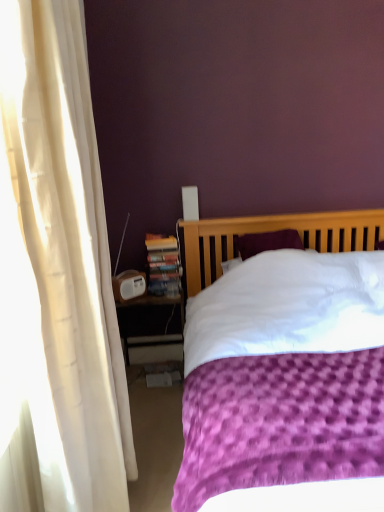
The image size is (384, 512). What do you see at coordinates (272, 231) in the screenshot?
I see `purple textured bed at center` at bounding box center [272, 231].

Based on the photo, what is the approximate height of hardcover book at left?

hardcover book at left is 15.03 inches tall.

Find the location of `purple textured bed at center`. purple textured bed at center is located at coordinates (272, 231).

Based on the photo, are white plastic nightstand at lower left and hardcover book at left far apart?

Actually, white plastic nightstand at lower left and hardcover book at left are a little close together.

From a real-world perspective, between white plastic nightstand at lower left and hardcover book at left, who is vertically higher?

From a 3D spatial view, hardcover book at left is above.

Relative to hardcover book at left, is white plastic nightstand at lower left in front or behind?

Clearly, white plastic nightstand at lower left is in front of hardcover book at left.

From the image's perspective, would you say white plastic nightstand at lower left is positioned over hardcover book at left?

Actually, white plastic nightstand at lower left appears below hardcover book at left in the image.

In the scene shown: Who is bigger, purple textured bed at center or hardcover book at left?

Bigger between the two is purple textured bed at center.

Is purple textured bed at center placed right next to hardcover book at left?

No, purple textured bed at center is not next to hardcover book at left.

Consider the image. Which object is positioned more to the right, purple textured bed at center or hardcover book at left?

purple textured bed at center is more to the right.

What's the angular difference between purple textured bed at center and hardcover book at left's facing directions?

They differ by 0.354 degrees in their facing directions.

Does hardcover book at left appear on the left side of purple textured bed at center?

Correct, you'll find hardcover book at left to the left of purple textured bed at center.

From the picture: From a real-world perspective, is hardcover book at left located beneath purple textured bed at center?

Incorrect, from a real-world perspective, hardcover book at left is higher than purple textured bed at center.

Does point (179, 271) appear closer or farther from the camera than point (275, 222)?

Point (179, 271) is positioned closer to the camera compared to point (275, 222).

Locate an element on the screen. paperback book behind the purple textured bed at center is located at coordinates (163, 266).

Could you tell me if purple textured bed at center is facing white plastic nightstand at lower left?

No, purple textured bed at center is not aimed at white plastic nightstand at lower left.

From the image's perspective, does purple textured bed at center appear lower than white plastic nightstand at lower left?

No.

Considering the sizes of objects purple textured bed at center and white plastic nightstand at lower left in the image provided, who is wider, purple textured bed at center or white plastic nightstand at lower left?

Wider between the two is purple textured bed at center.

Does point (177, 302) lie in front of point (346, 482)?

No.

Is white plastic nightstand at lower left spatially inside purple textured bed at center, or outside of it?

white plastic nightstand at lower left is spatially situated outside purple textured bed at center.

Where is `nightstand that appears below the purple textured bed at center (from the image's perspective)`? nightstand that appears below the purple textured bed at center (from the image's perspective) is located at coordinates (151, 329).

From the picture: Is white plastic nightstand at lower left placed right next to purple textured bed at center?

There is a gap between white plastic nightstand at lower left and purple textured bed at center.

From the picture: From the image's perspective, is hardcover book at left located beneath white plastic nightstand at lower left?

No, from the image's perspective, hardcover book at left is not beneath white plastic nightstand at lower left.

Is hardcover book at left facing towards white plastic nightstand at lower left?

No, hardcover book at left does not turn towards white plastic nightstand at lower left.

Which is more to the left, hardcover book at left or white plastic nightstand at lower left?

Positioned to the left is white plastic nightstand at lower left.

This screenshot has width=384, height=512. I want to click on paperback book that appears above the white plastic nightstand at lower left (from a real-world perspective), so click(x=163, y=266).

Where is `bed below the hardcover book at left (from a real-world perspective)`? The height and width of the screenshot is (512, 384). bed below the hardcover book at left (from a real-world perspective) is located at coordinates (272, 231).

Looking at the image, which one is located further to hardcover book at left, purple textured bed at center or white plastic nightstand at lower left?

purple textured bed at center is further to hardcover book at left.

Considering their positions, is white plastic nightstand at lower left positioned closer to hardcover book at left than purple textured bed at center?

Among the two, white plastic nightstand at lower left is located nearer to hardcover book at left.

Consider the image. Considering their positions, is hardcover book at left positioned closer to purple textured bed at center than white plastic nightstand at lower left?

Among the two, hardcover book at left is located nearer to purple textured bed at center.

Which object lies nearer to the anchor point white plastic nightstand at lower left, purple textured bed at center or hardcover book at left?

The object closer to white plastic nightstand at lower left is hardcover book at left.

From the image, which object appears to be nearer to white plastic nightstand at lower left, hardcover book at left or purple textured bed at center?

hardcover book at left.

From the image, which object appears to be farther from purple textured bed at center, white plastic nightstand at lower left or hardcover book at left?

The object further to purple textured bed at center is white plastic nightstand at lower left.

Image resolution: width=384 pixels, height=512 pixels. In order to click on nightstand positioned between purple textured bed at center and hardcover book at left from near to far in this screenshot , I will do `click(151, 329)`.